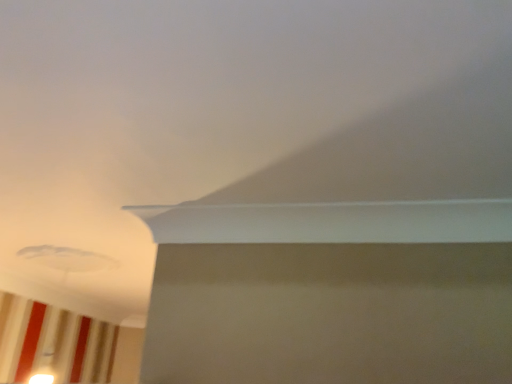
Where is `striped fabric curtain at lower left`? This screenshot has width=512, height=384. striped fabric curtain at lower left is located at coordinates (52, 343).

What do you see at coordinates (52, 343) in the screenshot?
I see `striped fabric curtain at lower left` at bounding box center [52, 343].

The image size is (512, 384). Identify the location of striped fabric curtain at lower left. (52, 343).